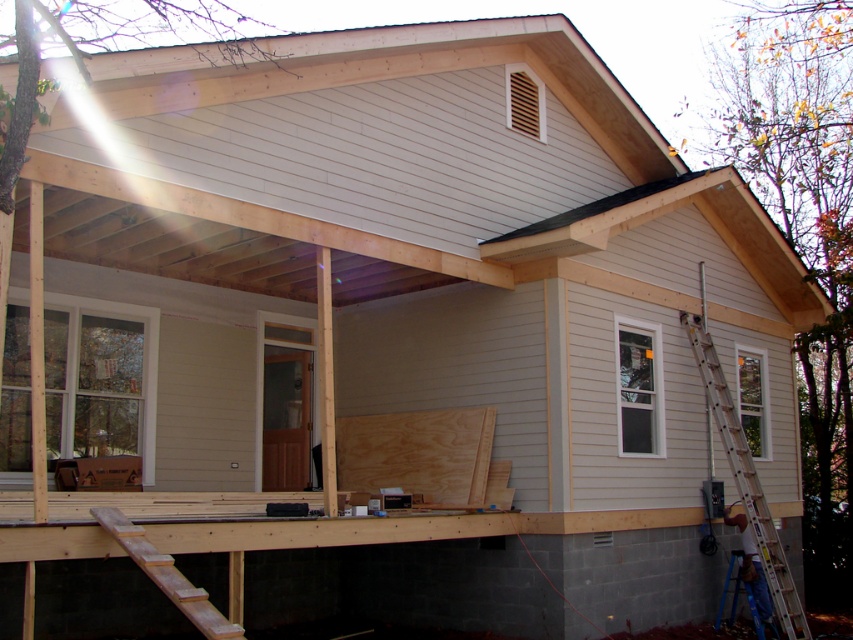
Does point (703, 362) lie in front of point (189, 596)?

No, (703, 362) is behind (189, 596).

Does blue metallic ladder at right appear on the left side of wooden ladder at lower left?

Incorrect, blue metallic ladder at right is not on the left side of wooden ladder at lower left.

Where is `blue metallic ladder at right`? The image size is (853, 640). blue metallic ladder at right is located at coordinates (746, 481).